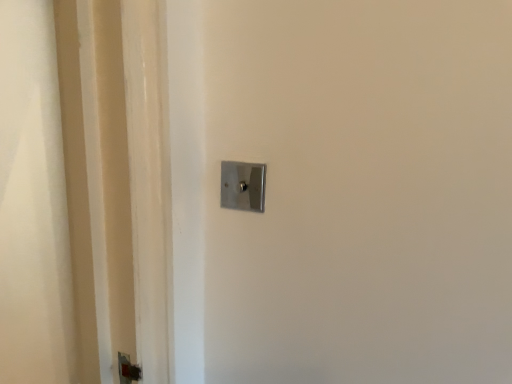
What do you see at coordinates (243, 186) in the screenshot? The height and width of the screenshot is (384, 512). I see `satin silver door handle at center` at bounding box center [243, 186].

Where is `satin silver door handle at center`? Image resolution: width=512 pixels, height=384 pixels. satin silver door handle at center is located at coordinates (243, 186).

Locate an element on the screen. Image resolution: width=512 pixels, height=384 pixels. satin silver door handle at center is located at coordinates (243, 186).